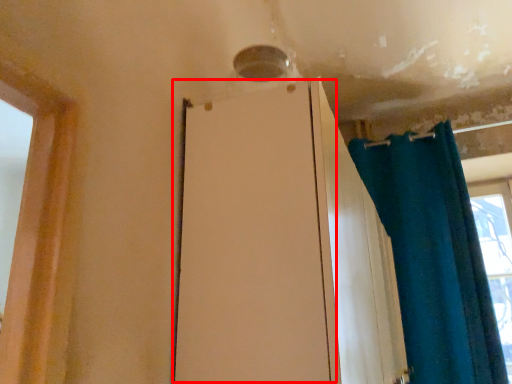
Question: From the image's perspective, where is screen door (annotated by the red box) located in relation to curtain in the image?

Choices:
 (A) above
 (B) below

Answer: (B)